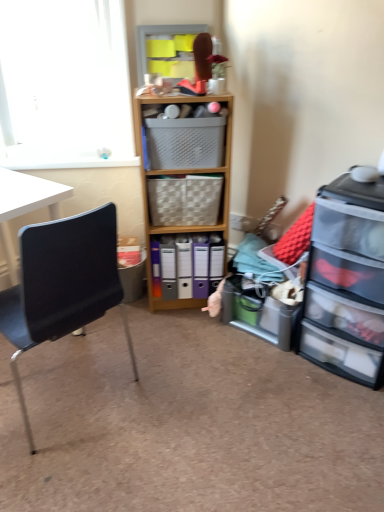
The image size is (384, 512). I want to click on matte plastic storage box at lower left, so click(133, 280).

Find the location of a particular element. matte plastic shelf at upper center, the 1th shelf viewed from the left is located at coordinates (167, 50).

The image size is (384, 512). Describe the element at coordinates (259, 314) in the screenshot. I see `translucent plastic storage at lower right, positioned as the 1th shelf in bottom-to-top order` at that location.

Where is `black matte chair at left`? black matte chair at left is located at coordinates (62, 285).

Identify the location of wooden cabinet at center. The height and width of the screenshot is (512, 384). (184, 193).

You are a GUI agent. You are given a task and a screenshot of the screen. Output one action in this format:
    pyautogui.click(x=<x>, y=<y>)
    Task: Click on the white matte window screen at upper left
    
    Given the screenshot: What is the action you would take?
    pyautogui.click(x=64, y=84)

Can you confirm if matte plastic shelf at upper center, marked as the second shelf in a bottom-to-top arrangement, is thinner than black matte chair at left?

Yes, matte plastic shelf at upper center, marked as the second shelf in a bottom-to-top arrangement, is thinner than black matte chair at left.

Can you tell me how much matte plastic shelf at upper center, arranged as the second shelf when viewed from the right, and black matte chair at left differ in facing direction?

The angular difference between matte plastic shelf at upper center, arranged as the second shelf when viewed from the right, and black matte chair at left is 133 degrees.

Is matte plastic shelf at upper center, marked as the second shelf in a bottom-to-top arrangement, not near black matte chair at left?

Yes, matte plastic shelf at upper center, marked as the second shelf in a bottom-to-top arrangement, and black matte chair at left are located far from each other.

Is matte plastic shelf at upper center, placed as the 1th shelf when sorted from top to bottom, bigger or smaller than black matte chair at left?

Considering their sizes, matte plastic shelf at upper center, placed as the 1th shelf when sorted from top to bottom, takes up less space than black matte chair at left.

From the image's perspective, is matte plastic shelf at upper center, arranged as the second shelf when viewed from the right, beneath translucent plastic storage at lower right, the 2th shelf positioned from the left?

No.

Can you confirm if matte plastic shelf at upper center, marked as the second shelf in a bottom-to-top arrangement, is bigger than translucent plastic storage at lower right, placed as the 1th shelf when sorted from right to left?

No, matte plastic shelf at upper center, marked as the second shelf in a bottom-to-top arrangement, is not bigger than translucent plastic storage at lower right, placed as the 1th shelf when sorted from right to left.

Is matte plastic shelf at upper center, placed as the 1th shelf when sorted from top to bottom, positioned behind translucent plastic storage at lower right, which is the second shelf from top to bottom?

No, it is in front of translucent plastic storage at lower right, which is the second shelf from top to bottom.

How many degrees apart are the facing directions of matte plastic shelf at upper center, placed as the 1th shelf when sorted from top to bottom, and translucent plastic storage at lower right, placed as the 1th shelf when sorted from right to left?

matte plastic shelf at upper center, placed as the 1th shelf when sorted from top to bottom, and translucent plastic storage at lower right, placed as the 1th shelf when sorted from right to left, are facing 42.9 degrees away from each other.

How distant is matte plastic shelf at upper center, arranged as the second shelf when viewed from the right, from clear plastic drawers at right?

matte plastic shelf at upper center, arranged as the second shelf when viewed from the right, and clear plastic drawers at right are 3.51 feet apart.

In the image, is matte plastic shelf at upper center, marked as the second shelf in a bottom-to-top arrangement, positioned in front of or behind clear plastic drawers at right?

Visually, matte plastic shelf at upper center, marked as the second shelf in a bottom-to-top arrangement, is located behind clear plastic drawers at right.

From the image's perspective, relative to clear plastic drawers at right, is matte plastic shelf at upper center, placed as the 1th shelf when sorted from top to bottom, above or below?

matte plastic shelf at upper center, placed as the 1th shelf when sorted from top to bottom, is above clear plastic drawers at right.

Is clear plastic drawers at right surrounded by matte plastic shelf at upper center, marked as the second shelf in a bottom-to-top arrangement?

Actually, clear plastic drawers at right is outside matte plastic shelf at upper center, marked as the second shelf in a bottom-to-top arrangement.

Based on their positions, is clear plastic drawers at right located to the left or right of woven beige picnic basket at center, arranged as the first picnic basket when ordered from the bottom?

In the image, clear plastic drawers at right appears on the right side of woven beige picnic basket at center, arranged as the first picnic basket when ordered from the bottom.

Identify the location of file cabinet on the right of the woven beige picnic basket at center, arranged as the first picnic basket when ordered from the bottom. Image resolution: width=384 pixels, height=512 pixels. (346, 282).

Choose the correct answer: Is clear plastic drawers at right inside woven beige picnic basket at center, arranged as the first picnic basket when ordered from the bottom, or outside it?

clear plastic drawers at right is located beyond the bounds of woven beige picnic basket at center, arranged as the first picnic basket when ordered from the bottom.

Consider the image. From a real-world perspective, is wooden cabinet at center above or below woven beige picnic basket at center, which ranks as the 2th picnic basket in top-to-bottom order?

From a real-world perspective, wooden cabinet at center is physically below woven beige picnic basket at center, which ranks as the 2th picnic basket in top-to-bottom order.

Can you tell me how much wooden cabinet at center and woven beige picnic basket at center, which ranks as the 2th picnic basket in top-to-bottom order, differ in facing direction?

wooden cabinet at center and woven beige picnic basket at center, which ranks as the 2th picnic basket in top-to-bottom order, are facing 1.34 degrees away from each other.

From the image's perspective, which object appears higher, wooden cabinet at center or woven beige picnic basket at center, which ranks as the 2th picnic basket in top-to-bottom order?

woven beige picnic basket at center, which ranks as the 2th picnic basket in top-to-bottom order, is shown above in the image.

Considering the positions of objects wooden cabinet at center and woven beige picnic basket at center, which ranks as the 2th picnic basket in top-to-bottom order, in the image provided, who is behind, wooden cabinet at center or woven beige picnic basket at center, which ranks as the 2th picnic basket in top-to-bottom order,?

woven beige picnic basket at center, which ranks as the 2th picnic basket in top-to-bottom order, is more distant.

Identify the location of window screen that appears above the matte plastic storage box at lower left (from the image's perspective). Image resolution: width=384 pixels, height=512 pixels. (64, 84).

Is white matte window screen at upper left oriented away from matte plastic storage box at lower left?

white matte window screen at upper left does not have its back to matte plastic storage box at lower left.

Considering the relative sizes of white matte window screen at upper left and matte plastic storage box at lower left in the image provided, is white matte window screen at upper left wider than matte plastic storage box at lower left?

No.

Which object is closer to the camera, white matte window screen at upper left or matte plastic storage box at lower left?

Positioned in front is white matte window screen at upper left.

Which of these two, translucent plastic storage at lower right, positioned as the 1th shelf in bottom-to-top order, or wooden cabinet at center, stands taller?

Standing taller between the two is wooden cabinet at center.

Considering the relative positions of translucent plastic storage at lower right, placed as the 1th shelf when sorted from right to left, and wooden cabinet at center in the image provided, is translucent plastic storage at lower right, placed as the 1th shelf when sorted from right to left, to the left of wooden cabinet at center from the viewer's perspective?

Incorrect, translucent plastic storage at lower right, placed as the 1th shelf when sorted from right to left, is not on the left side of wooden cabinet at center.

The image size is (384, 512). I want to click on chair lying in front of the matte plastic shelf at upper center, the 1th shelf viewed from the left, so pyautogui.click(x=62, y=285).

Image resolution: width=384 pixels, height=512 pixels. In order to click on shelf below the matte plastic shelf at upper center, placed as the 1th shelf when sorted from top to bottom (from the image's perspective) in this screenshot , I will do `click(259, 314)`.

Looking at the image, which one is located further to black matte chair at left, woven beige picnic basket at center, arranged as the first picnic basket when ordered from the bottom, or wooden cabinet at center?

wooden cabinet at center is further to black matte chair at left.

When comparing their distances from matte plastic shelf at upper center, marked as the second shelf in a bottom-to-top arrangement, does clear plastic drawers at right or plastic basket at center, the 1th picnic basket from the top, seem closer?

plastic basket at center, the 1th picnic basket from the top, is closer to matte plastic shelf at upper center, marked as the second shelf in a bottom-to-top arrangement.

From the image, which object appears to be farther from white matte window screen at upper left, wooden cabinet at center or matte plastic storage box at lower left?

Among the two, matte plastic storage box at lower left is located further to white matte window screen at upper left.

Which object lies nearer to the anchor point wooden cabinet at center, matte plastic shelf at upper center, marked as the second shelf in a bottom-to-top arrangement, or matte plastic storage box at lower left?

Based on the image, matte plastic storage box at lower left appears to be nearer to wooden cabinet at center.

Which object lies further to the anchor point woven beige picnic basket at center, which ranks as the 2th picnic basket in top-to-bottom order, plastic basket at center, the second picnic basket positioned from the bottom, or translucent plastic storage at lower right, which is the second shelf from top to bottom?

translucent plastic storage at lower right, which is the second shelf from top to bottom, lies further to woven beige picnic basket at center, which ranks as the 2th picnic basket in top-to-bottom order, than the other object.

Considering their positions, is matte plastic shelf at upper center, arranged as the second shelf when viewed from the right, positioned further to translucent plastic storage at lower right, the 2th shelf positioned from the left, than clear plastic drawers at right?

Among the two, matte plastic shelf at upper center, arranged as the second shelf when viewed from the right, is located further to translucent plastic storage at lower right, the 2th shelf positioned from the left.

Looking at the image, which one is located closer to matte plastic shelf at upper center, placed as the 1th shelf when sorted from top to bottom, black matte chair at left or white matte window screen at upper left?

Based on the image, white matte window screen at upper left appears to be nearer to matte plastic shelf at upper center, placed as the 1th shelf when sorted from top to bottom.

Looking at the image, which one is located further to white matte window screen at upper left, plastic basket at center, the 1th picnic basket from the top, or translucent plastic storage at lower right, placed as the 1th shelf when sorted from right to left?

translucent plastic storage at lower right, placed as the 1th shelf when sorted from right to left, is positioned further to the anchor white matte window screen at upper left.

Where is `picnic basket between black matte chair at left and translucent plastic storage at lower right, which is the second shelf from top to bottom, in the front-back direction`? The image size is (384, 512). picnic basket between black matte chair at left and translucent plastic storage at lower right, which is the second shelf from top to bottom, in the front-back direction is located at coordinates (184, 142).

At what (x,y) coordinates should I click in order to perform the action: click on window screen between matte plastic shelf at upper center, placed as the 1th shelf when sorted from top to bottom, and translucent plastic storage at lower right, placed as the 1th shelf when sorted from right to left, in the up-down direction. Please return your answer as a coordinate pair (x, y). The width and height of the screenshot is (384, 512). Looking at the image, I should click on (64, 84).

Image resolution: width=384 pixels, height=512 pixels. In order to click on chair between matte plastic shelf at upper center, marked as the second shelf in a bottom-to-top arrangement, and translucent plastic storage at lower right, the 2th shelf positioned from the left, vertically in this screenshot , I will do `click(62, 285)`.

This screenshot has width=384, height=512. I want to click on cabinetry that lies between woven beige picnic basket at center, which ranks as the 2th picnic basket in top-to-bottom order, and matte plastic storage box at lower left from top to bottom, so (184, 193).